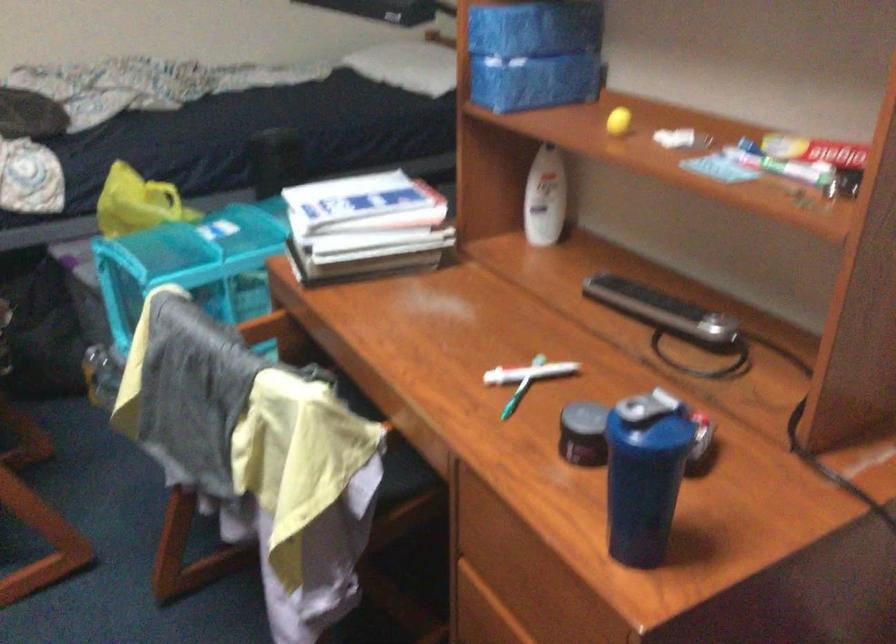
The height and width of the screenshot is (644, 896). In order to click on lotion bottle cap in this screenshot , I will do `click(541, 147)`.